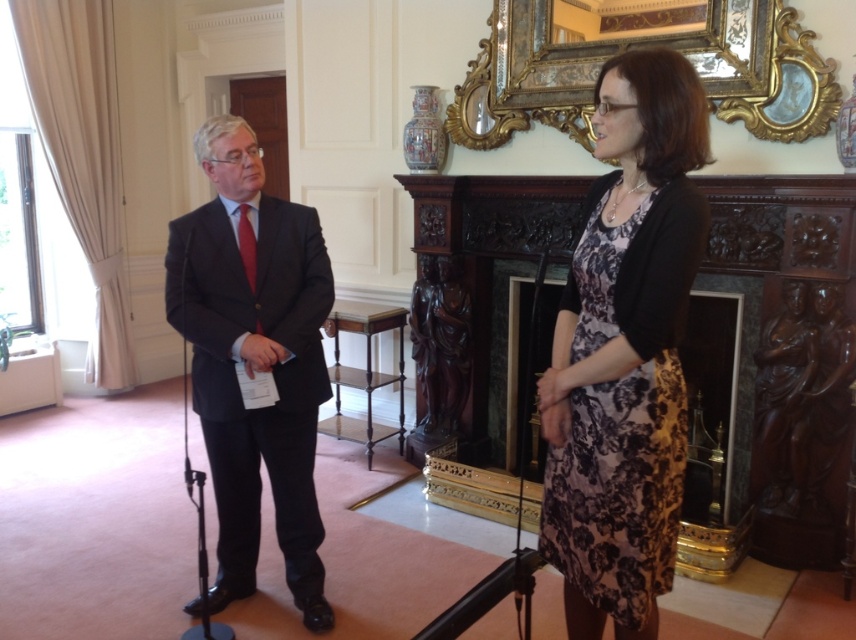
Does dark gray suit at left appear under gold ornate picture frame at upper center?

Indeed, dark gray suit at left is positioned under gold ornate picture frame at upper center.

Is dark gray suit at left above gold ornate picture frame at upper center?

No, dark gray suit at left is not above gold ornate picture frame at upper center.

What do you see at coordinates (254, 358) in the screenshot? I see `dark gray suit at left` at bounding box center [254, 358].

The height and width of the screenshot is (640, 856). Identify the location of dark gray suit at left. tap(254, 358).

Consider the image. Who is taller, floral-patterned fabric dress at center or dark gray suit at left?

With more height is dark gray suit at left.

Between floral-patterned fabric dress at center and dark gray suit at left, which one appears on the left side from the viewer's perspective?

dark gray suit at left is more to the left.

Between point (623, 538) and point (242, 252), which one is positioned behind?

The point (242, 252) is behind.

At what (x,y) coordinates should I click in order to perform the action: click on floral-patterned fabric dress at center. Please return your answer as a coordinate pair (x, y). The image size is (856, 640). Looking at the image, I should click on (622, 410).

Does floral-patterned fabric dress at center have a larger size compared to gold ornate picture frame at upper center?

No, floral-patterned fabric dress at center is not bigger than gold ornate picture frame at upper center.

Is floral-patterned fabric dress at center taller than gold ornate picture frame at upper center?

Indeed, floral-patterned fabric dress at center has a greater height compared to gold ornate picture frame at upper center.

The height and width of the screenshot is (640, 856). Find the location of `floral-patterned fabric dress at center`. floral-patterned fabric dress at center is located at coordinates (622, 410).